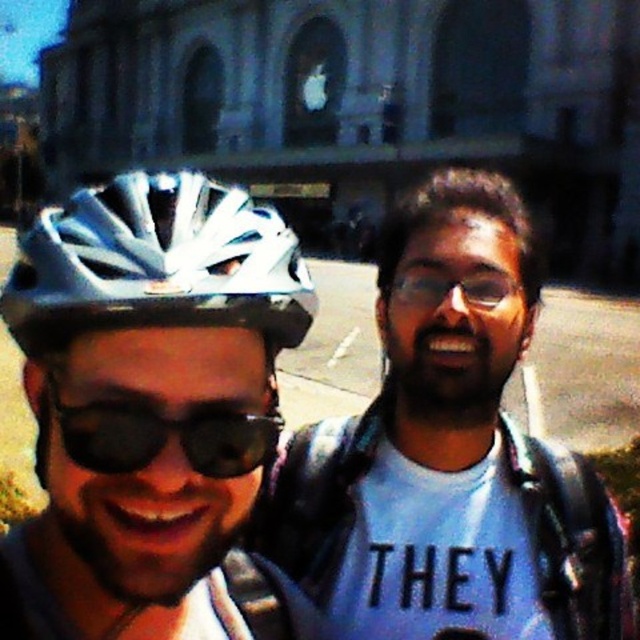
Question: Which point is closer to the camera?

Choices:
 (A) (483, 182)
 (B) (173, 323)

Answer: (B)

Question: Which of the following is the closest to the observer?

Choices:
 (A) (244, 417)
 (B) (125, 184)

Answer: (A)

Question: Does shiny silver helmet at left have a larger size compared to black reflective sunglasses at center?

Choices:
 (A) no
 (B) yes

Answer: (B)

Question: Which point is closer to the camera?

Choices:
 (A) matte black helmet at left
 (B) black reflective sunglasses at center

Answer: (A)

Question: Can you confirm if shiny silver helmet at left is positioned above black reflective sunglasses at center?

Choices:
 (A) no
 (B) yes

Answer: (B)

Question: Does shiny silver helmet at left lie behind black reflective sunglasses at center?

Choices:
 (A) yes
 (B) no

Answer: (B)